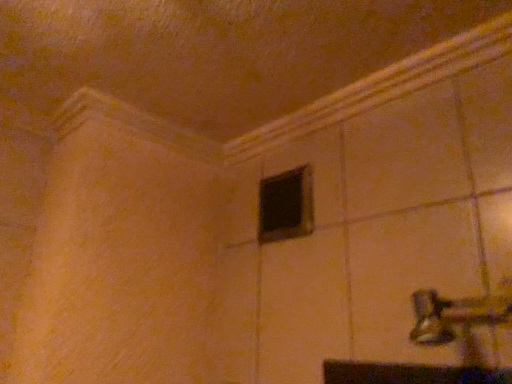
Image resolution: width=512 pixels, height=384 pixels. I want to click on metallic silver door handle at lower right, so pos(453,315).

What do you see at coordinates (453, 315) in the screenshot? The image size is (512, 384). I see `metallic silver door handle at lower right` at bounding box center [453, 315].

The image size is (512, 384). I want to click on black matte window at center, so click(x=286, y=205).

Measure the distance between point (302, 214) and camera.

Point (302, 214) and camera are 38.35 inches apart.

The image size is (512, 384). Describe the element at coordinates (286, 205) in the screenshot. I see `black matte window at center` at that location.

This screenshot has width=512, height=384. Find the location of `metallic silver door handle at lower right`. metallic silver door handle at lower right is located at coordinates (453, 315).

In the scene shown: Which is more to the right, black matte window at center or metallic silver door handle at lower right?

metallic silver door handle at lower right is more to the right.

Considering the relative positions of black matte window at center and metallic silver door handle at lower right in the image provided, is black matte window at center in front of metallic silver door handle at lower right?

No.

Does point (295, 226) come farther from viewer compared to point (418, 305)?

Yes.

From the image's perspective, does black matte window at center appear lower than metallic silver door handle at lower right?

No, from the image's perspective, black matte window at center is not below metallic silver door handle at lower right.

From a real-world perspective, between black matte window at center and metallic silver door handle at lower right, who is vertically lower?

metallic silver door handle at lower right.

Considering the relative sizes of black matte window at center and metallic silver door handle at lower right in the image provided, is black matte window at center thinner than metallic silver door handle at lower right?

Indeed, black matte window at center has a lesser width compared to metallic silver door handle at lower right.

Considering the sizes of objects black matte window at center and metallic silver door handle at lower right in the image provided, who is shorter, black matte window at center or metallic silver door handle at lower right?

metallic silver door handle at lower right is shorter.

Which of these two, black matte window at center or metallic silver door handle at lower right, is bigger?

With larger size is metallic silver door handle at lower right.

Is black matte window at center located outside metallic silver door handle at lower right?

Yes, black matte window at center is outside of metallic silver door handle at lower right.

Is black matte window at center far from metallic silver door handle at lower right?

No, black matte window at center is in close proximity to metallic silver door handle at lower right.

Is black matte window at center facing towards metallic silver door handle at lower right?

No, black matte window at center is not aimed at metallic silver door handle at lower right.

Locate an element on the screen. This screenshot has width=512, height=384. window that appears above the metallic silver door handle at lower right (from a real-world perspective) is located at coordinates (286, 205).

Between metallic silver door handle at lower right and black matte window at center, which one appears on the left side from the viewer's perspective?

Positioned to the left is black matte window at center.

Is metallic silver door handle at lower right further to camera compared to black matte window at center?

That is False.

Is point (426, 302) behind point (308, 198)?

No.

From the image's perspective, which object appears higher, metallic silver door handle at lower right or black matte window at center?

black matte window at center is shown above in the image.

From a real-world perspective, is metallic silver door handle at lower right located higher than black matte window at center?

No, from a real-world perspective, metallic silver door handle at lower right is not above black matte window at center.

Can you confirm if metallic silver door handle at lower right is thinner than black matte window at center?

Incorrect, the width of metallic silver door handle at lower right is not less than that of black matte window at center.

Between metallic silver door handle at lower right and black matte window at center, which one has less height?

Standing shorter between the two is metallic silver door handle at lower right.

Between metallic silver door handle at lower right and black matte window at center, which one has smaller size?

black matte window at center is smaller.

Which is correct: metallic silver door handle at lower right is inside black matte window at center, or outside of it?

metallic silver door handle at lower right is spatially situated outside black matte window at center.

Is metallic silver door handle at lower right touching black matte window at center?

No, metallic silver door handle at lower right is not with black matte window at center.

Does metallic silver door handle at lower right turn towards black matte window at center?

No.

Can you tell me how much metallic silver door handle at lower right and black matte window at center differ in facing direction?

The angular difference between metallic silver door handle at lower right and black matte window at center is 0.409 degrees.

You are a GUI agent. You are given a task and a screenshot of the screen. Output one action in this format:
    pyautogui.click(x=<x>, y=<y>)
    Task: Click on the window on the left of metallic silver door handle at lower right
    The height and width of the screenshot is (384, 512).
    Given the screenshot: What is the action you would take?
    pyautogui.click(x=286, y=205)

You are a GUI agent. You are given a task and a screenshot of the screen. Output one action in this format:
    pyautogui.click(x=<x>, y=<y>)
    Task: Click on the door handle below the black matte window at center (from a real-world perspective)
    The image size is (512, 384).
    Given the screenshot: What is the action you would take?
    pyautogui.click(x=453, y=315)

I want to click on window above the metallic silver door handle at lower right (from a real-world perspective), so click(286, 205).